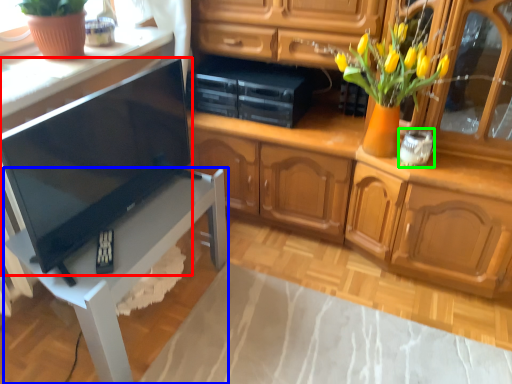
Question: Estimate the real-world distances between objects in this image. Which object is closer to television (highlighted by a red box), table (highlighted by a blue box) or appliance (highlighted by a green box)?

Choices:
 (A) table
 (B) appliance

Answer: (A)